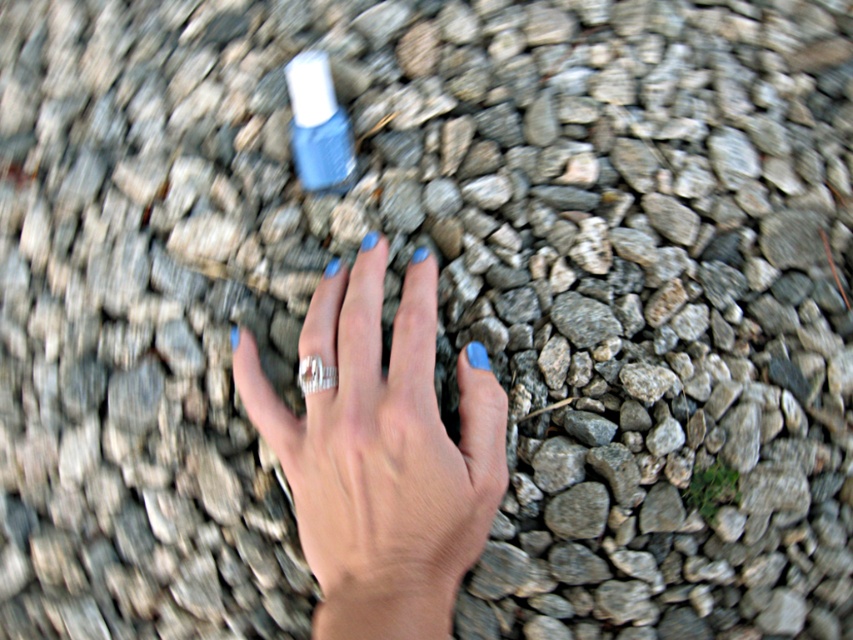
You are an artist trying to paint the scene shown in the image. You need to place the blue glass nail polish at center in your painting. Where exactly should you place it?

The blue glass nail polish at center should be placed at the 2D coordinates point (x=318, y=125) in your painting.